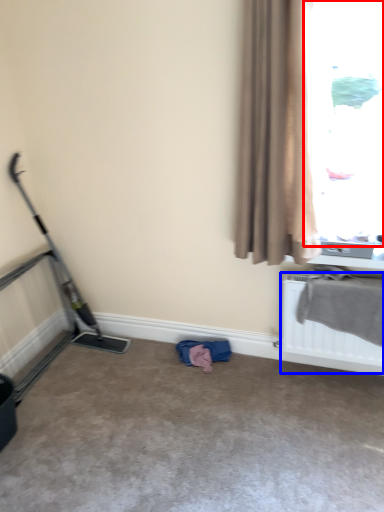
Question: Among these objects, which one is nearest to the camera, window (highlighted by a red box) or radiator (highlighted by a blue box)?

Choices:
 (A) window
 (B) radiator

Answer: (A)